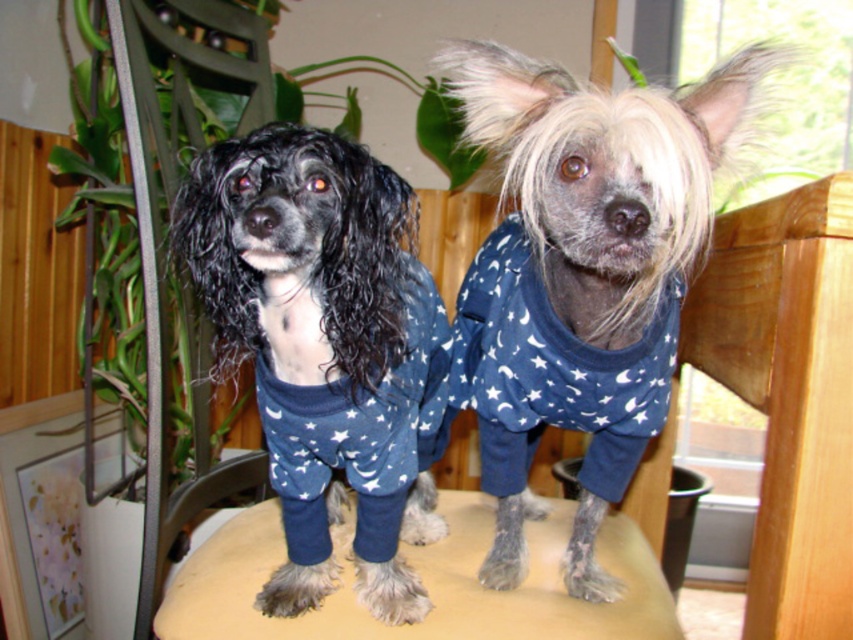
You are a photographer trying to capture a clear shot of the shiny black fur at center and the beige fabric stool at center. Which object should you focus on first if you want to ensure both are in focus without adjusting your camera settings?

The shiny black fur at center is closer to the viewer than the beige fabric stool at center, so you should focus on the shiny black fur at center first to ensure both are in focus.

You are a dog owner trying to clean your home. You see the shiny black fur at center and the beige fabric stool at center. Which object is located higher up?

The shiny black fur at center is above the beige fabric stool at center, so it is located higher up.